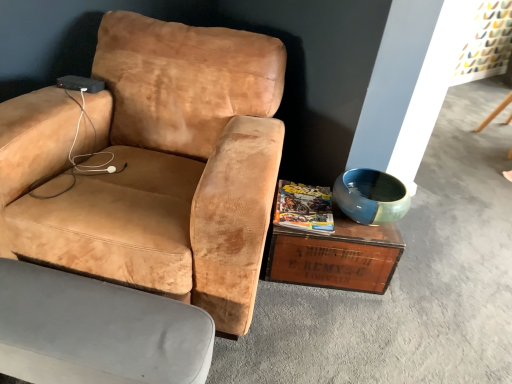
This screenshot has height=384, width=512. I want to click on vacant area that lies in front of wooden crate at lower right, so click(x=328, y=333).